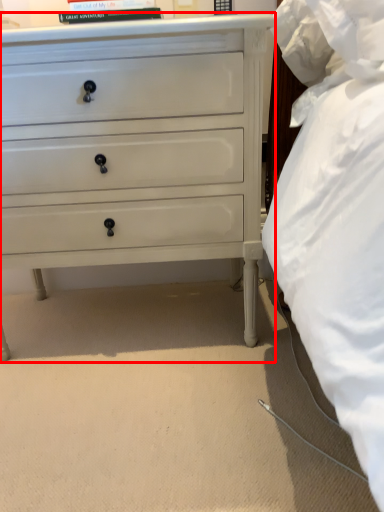
Question: Considering the relative positions of chest of drawers (annotated by the red box) and book in the image provided, where is chest of drawers (annotated by the red box) located with respect to the staircase?

Choices:
 (A) left
 (B) right

Answer: (A)